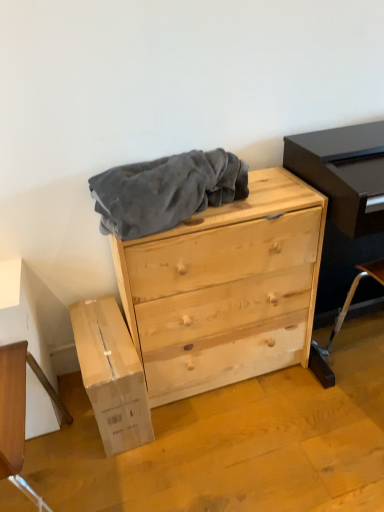
Find the location of `free spot to the right of white cardboard box at lower left`. free spot to the right of white cardboard box at lower left is located at coordinates (196, 425).